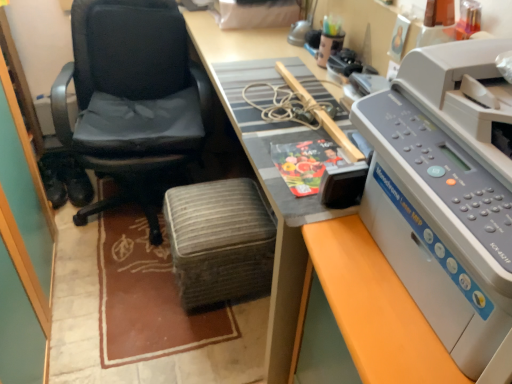
Identify the location of free space above woven fabric stool at center (from a real-world perspective). This screenshot has height=384, width=512. (211, 211).